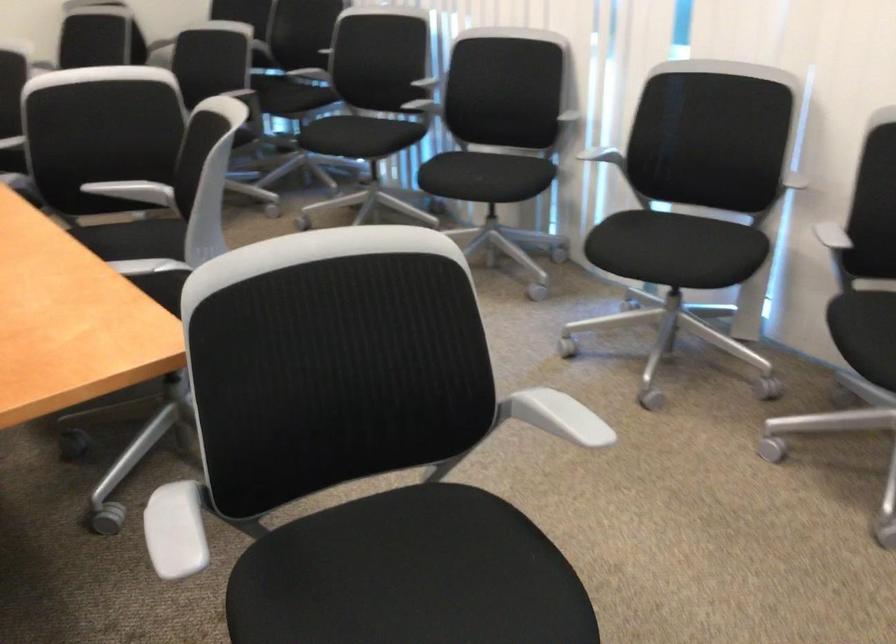
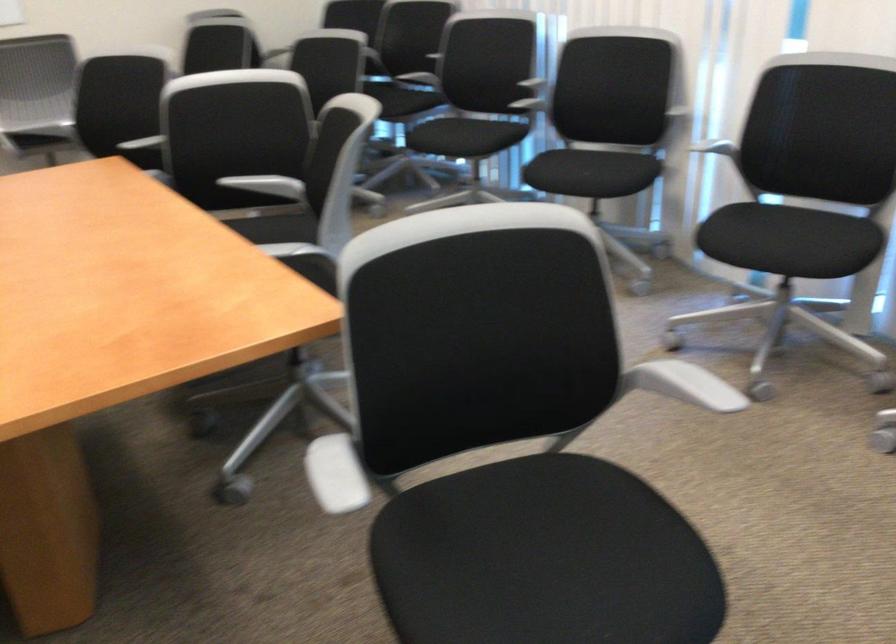
The point at (483, 178) is marked in the first image. Where is the corresponding point in the second image?

(587, 174)